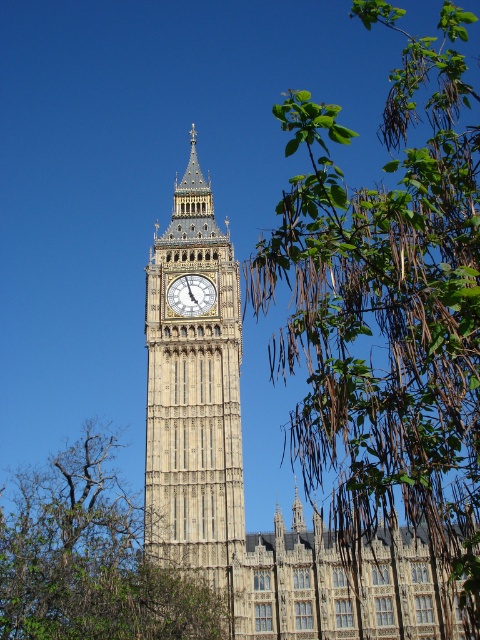
Question: Is green leafy branches at upper right closer to camera compared to green leafy tree at lower left?

Choices:
 (A) yes
 (B) no

Answer: (A)

Question: Estimate the real-world distances between objects in this image. Which object is closer to the green leafy branches at upper right?

Choices:
 (A) stone clock tower at center
 (B) white stone clock at center

Answer: (A)

Question: Which point is farther from the camera taking this photo?

Choices:
 (A) (313, 406)
 (B) (228, 467)
 (C) (291, 506)

Answer: (C)

Question: Does green leafy branches at upper right lie behind white stone clock at center?

Choices:
 (A) yes
 (B) no

Answer: (B)

Question: Based on their relative distances, which object is nearer to the green leafy tree at lower left?

Choices:
 (A) white stone clock at center
 (B) stone clock tower at center

Answer: (B)

Question: Is green leafy branches at upper right in front of stone clock tower at center?

Choices:
 (A) yes
 (B) no

Answer: (A)